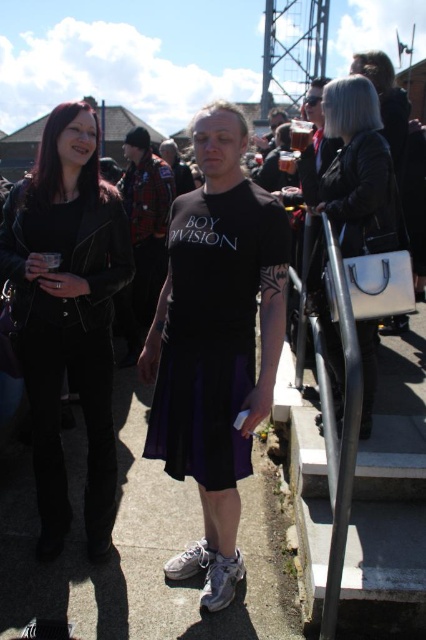
Question: Which is farther from the silver metallic handbag at upper right?

Choices:
 (A) matte black t-shirt at center
 (B) matte black leather jacket at left
 (C) black matte skirt at center

Answer: (A)

Question: Considering the relative positions of matte black leather jacket at left and matte black t-shirt at center in the image provided, where is matte black leather jacket at left located with respect to matte black t-shirt at center?

Choices:
 (A) left
 (B) right

Answer: (A)

Question: Can you confirm if silver metallic handbag at upper right is positioned to the right of matte black t-shirt at center?

Choices:
 (A) yes
 (B) no

Answer: (B)

Question: Which point is closer to the camera?

Choices:
 (A) matte black t-shirt at center
 (B) plaid fabric shirt at center
 (C) black matte t-shirt at center
 (D) matte black leather jacket at left

Answer: (D)

Question: Based on their relative distances, which object is farther from the plaid fabric shirt at center?

Choices:
 (A) black matte skirt at center
 (B) matte black leather jacket at left
 (C) black matte t-shirt at center
 (D) silver metallic handbag at upper right

Answer: (A)

Question: Can you confirm if black matte skirt at center is wider than silver metallic handbag at upper right?

Choices:
 (A) no
 (B) yes

Answer: (B)